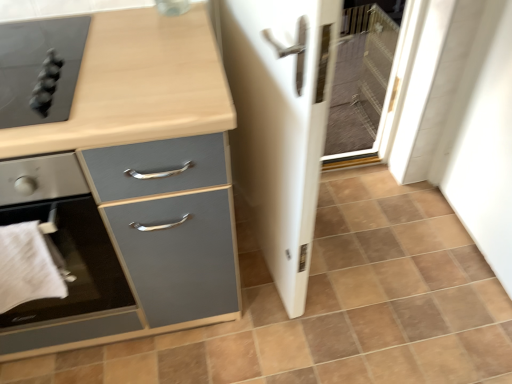
Where is `vacant area located to the right-hand side of matte gray cabinet at left`? vacant area located to the right-hand side of matte gray cabinet at left is located at coordinates (334, 293).